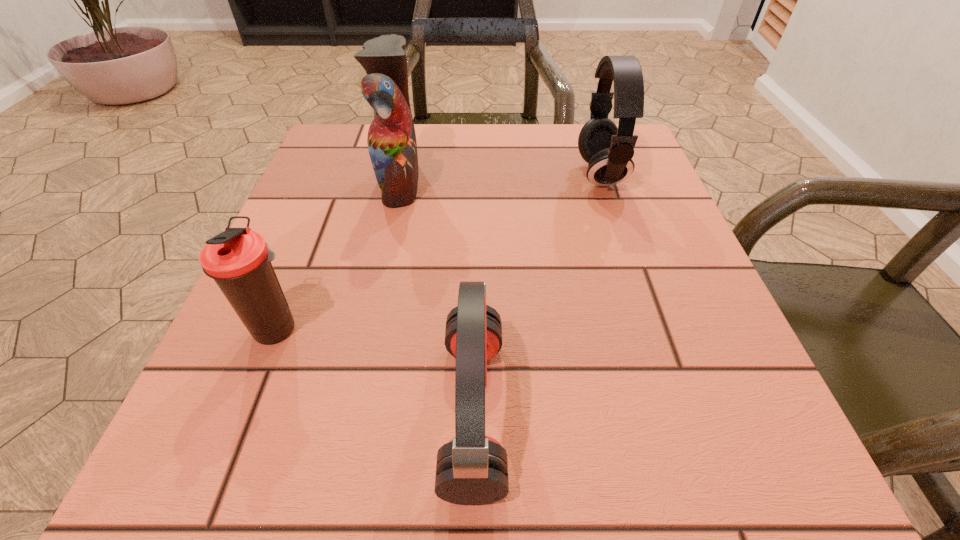
Find the location of a particular element. The width and height of the screenshot is (960, 540). parrot is located at coordinates (392, 145).

Find the location of `the right earphone`. the right earphone is located at coordinates coord(609,150).

This screenshot has height=540, width=960. I want to click on the farther earphone, so click(x=609, y=150).

Locate an element on the screen. This screenshot has width=960, height=540. the leftmost object is located at coordinates (239, 260).

Find the location of a particular element. The width and height of the screenshot is (960, 540). the nearer earphone is located at coordinates (471, 469).

Locate an element on the screen. This screenshot has width=960, height=540. the left earphone is located at coordinates pyautogui.click(x=471, y=469).

The height and width of the screenshot is (540, 960). What are the coordinates of `vacant space located at the face of the second object from left to right` in the screenshot? It's located at (572, 182).

Locate an element on the screen. The width and height of the screenshot is (960, 540). free space located 0.400m on the ear cups of the right earphone is located at coordinates (388, 174).

Identify the location of free space located 0.350m on the ear cups of the right earphone. The image size is (960, 540). (411, 174).

At what (x,y) coordinates should I click in order to perform the action: click on vacant space located on the ear cups of the right earphone. Please return your answer as a coordinate pair (x, y). This screenshot has width=960, height=540. Looking at the image, I should click on (464, 174).